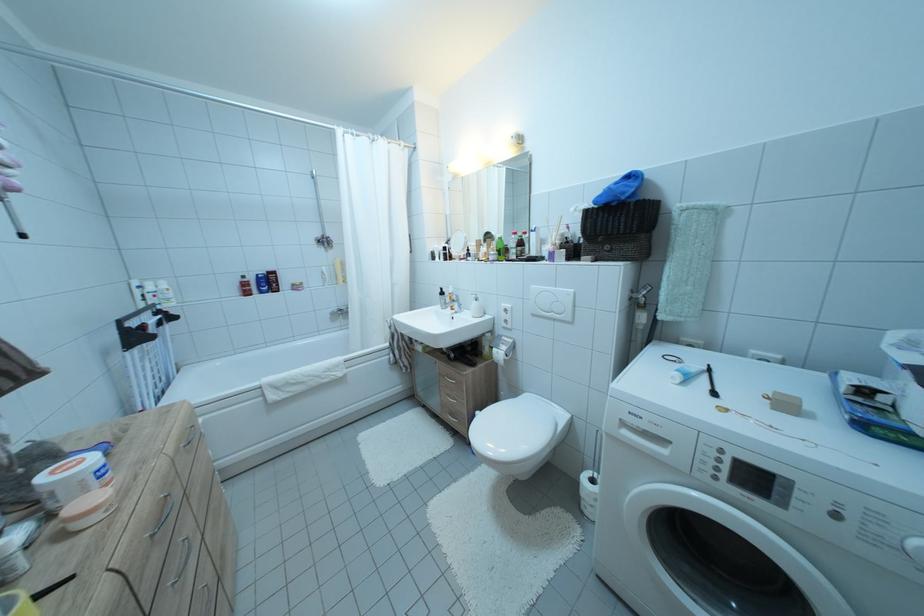
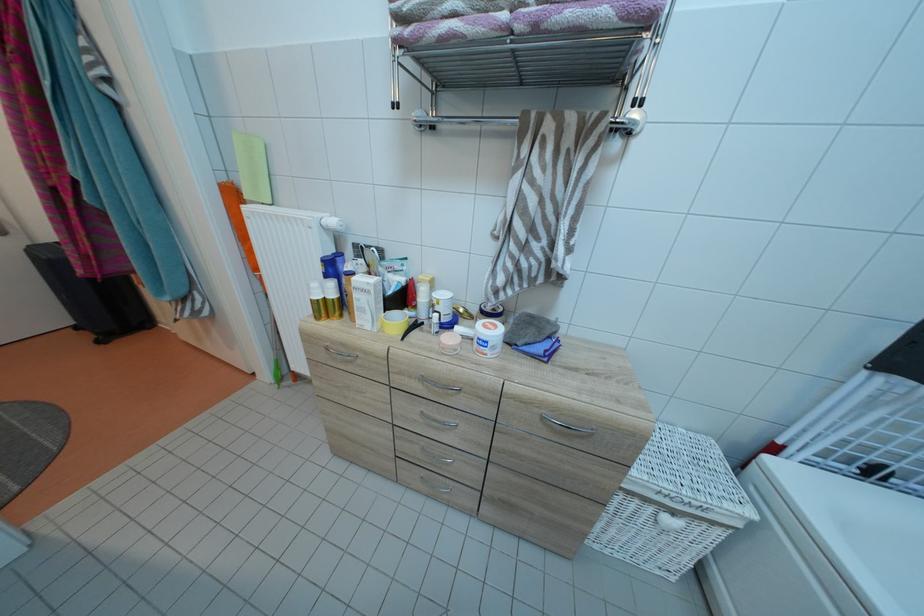
Locate, in the second image, the point that corresponds to (x=89, y=467) in the first image.

(496, 334)